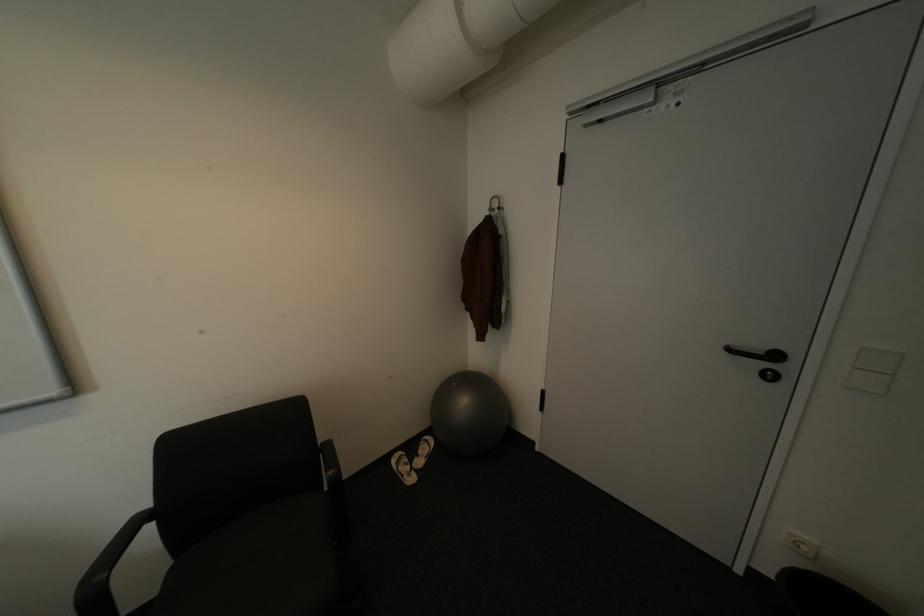
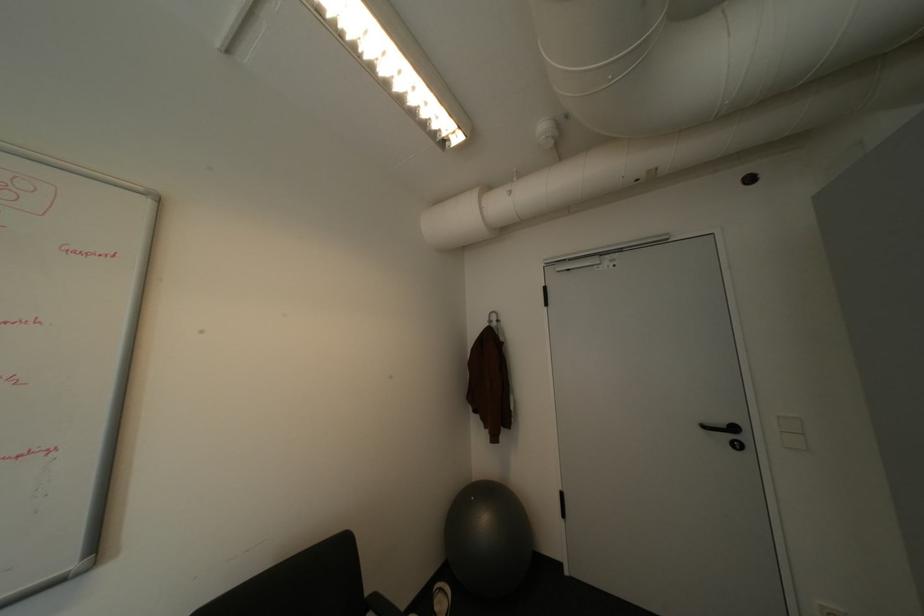
In a continuous first-person perspective shot, in which direction is the camera moving?

Answer: The cameraman walked toward left, backward.